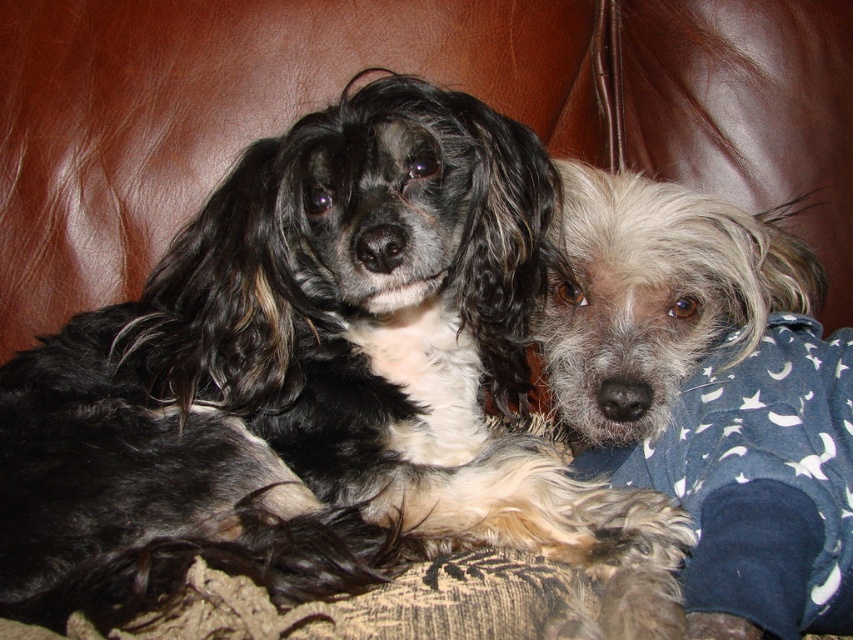
You are a dog owner who wants to buy a new blanket for your dogs. The couch they are currently lying on is 1.5 meters wide. If you want to place both the black silky fur dog at center and the gray fluffy dog at center side by side on the blanket, what is the minimum width of the blanket needed?

The black silky fur dog at center is wider than the gray fluffy dog at center. To place them side by side, the minimum width of the blanket should be the sum of both their widths. However, since their exact widths aren not provided, we can only state that the blanket must be wider than the combined width of both dogs.

Looking at this image, you are a dog owner who wants to ensure both dogs have enough space on the couch. Given that the couch is 1.5 meters wide, can both the black silky fur dog at center and the gray fluffy dog at center fit comfortably if the bigger dog takes up 0.8 meters and the smaller one 0.5 meters?

The black silky fur dog at center is bigger than the gray fluffy dog at center. Since the bigger dog takes up 0.8 meters and the smaller one 0.5 meters, combined they require 1.3 meters. The couch is 1.5 meters wide, so there is enough space for both dogs to fit comfortably.